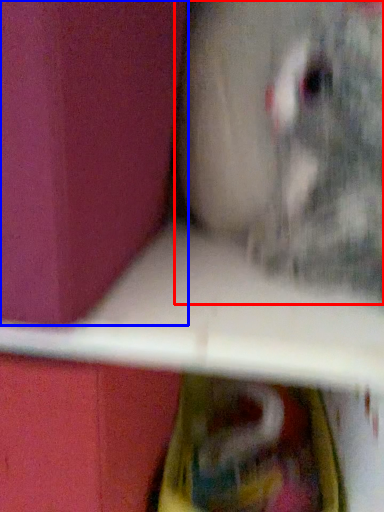
Question: Which of the following is the closest to the observer, animal (highlighted by a red box) or box (highlighted by a blue box)?

Choices:
 (A) animal
 (B) box

Answer: (B)